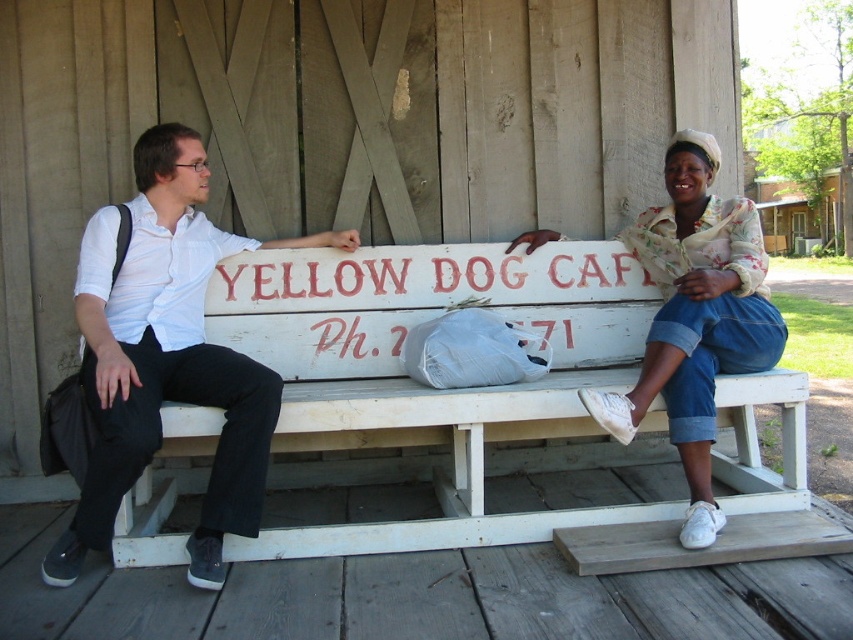
Question: Is white wooden bench at center behind denim skirt at right?

Choices:
 (A) no
 (B) yes

Answer: (B)

Question: Which object is the closest to the denim skirt at right?

Choices:
 (A) white cotton shirt at left
 (B) white wooden bench at center

Answer: (B)

Question: Does white cotton shirt at left appear on the right side of denim skirt at right?

Choices:
 (A) yes
 (B) no

Answer: (B)

Question: Which point is closer to the camera?

Choices:
 (A) white wooden bench at center
 (B) denim skirt at right
 (C) white cotton shirt at left

Answer: (C)

Question: Can you confirm if white wooden bench at center is bigger than white cotton shirt at left?

Choices:
 (A) no
 (B) yes

Answer: (B)

Question: Among these points, which one is nearest to the camera?

Choices:
 (A) (579, 278)
 (B) (740, 336)
 (C) (123, 396)

Answer: (C)